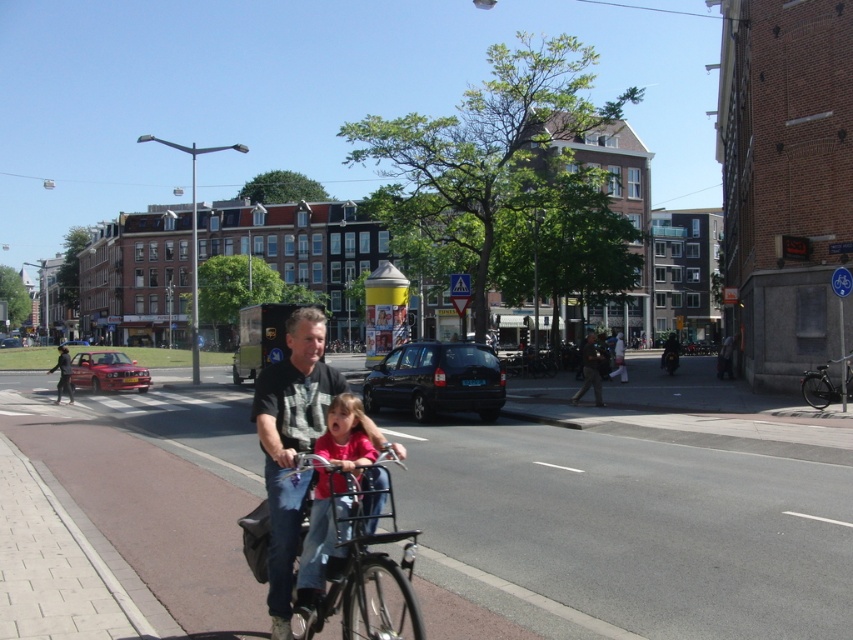
You are a photographer standing on the sidewalk and want to take a photo of the pink matte shirt at center and the dark gray jacket at center. Which one will appear larger in your photo?

The pink matte shirt at center will appear larger in the photo because it is closer to the viewer than the dark gray jacket at center.

In the scene shown: You are a fashion designer observing the urban street scene. You notice the pink matte shirt at center and the dark gray jacket at center. Which clothing item is shorter in length?

The pink matte shirt at center is shorter than the dark gray jacket at center.